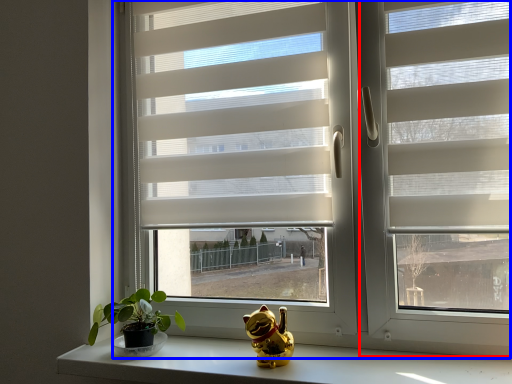
Question: Which object appears farthest to the camera in this image, screen door (highlighted by a red box) or window (highlighted by a blue box)?

Choices:
 (A) screen door
 (B) window

Answer: (B)